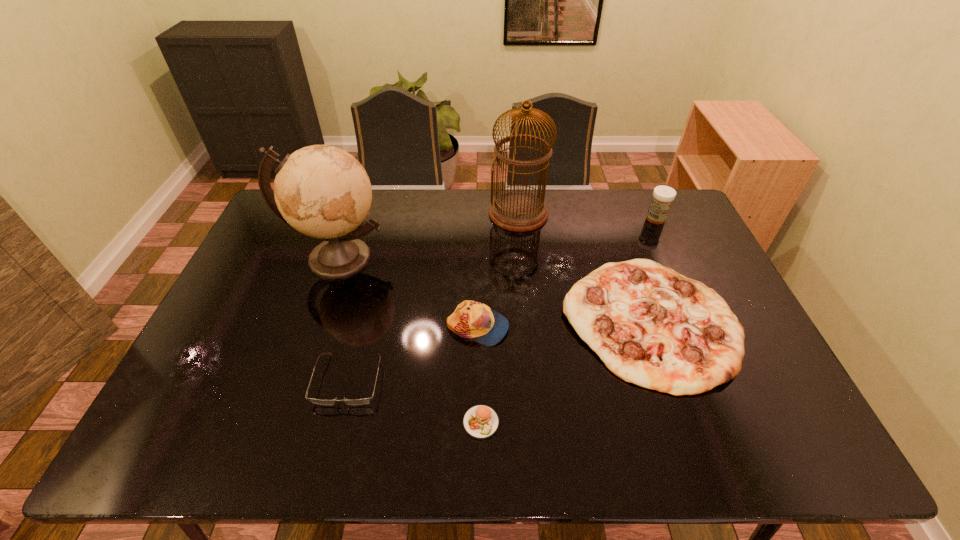
This screenshot has width=960, height=540. I want to click on vacant region located on the bill of the fourth tallest object, so click(645, 327).

Where is `vacant space located 0.060m on the front of the fifth tallest object`? The image size is (960, 540). vacant space located 0.060m on the front of the fifth tallest object is located at coordinates (684, 420).

You are a GUI agent. You are given a task and a screenshot of the screen. Output one action in this format:
    pyautogui.click(x=<x>, y=<y>)
    Task: Click on the vacant position located 0.060m on the right of the shortest object
    The height and width of the screenshot is (540, 960).
    Given the screenshot: What is the action you would take?
    pyautogui.click(x=525, y=422)

Identify the location of birdcage situated at the far edge. (519, 211).

Where is `medicine that is positioned at the far edge`? Image resolution: width=960 pixels, height=540 pixels. medicine that is positioned at the far edge is located at coordinates point(663,196).

Where is `object that is at the near edge`? The width and height of the screenshot is (960, 540). object that is at the near edge is located at coordinates (481, 422).

Locate an element on the screen. Image resolution: width=960 pixels, height=540 pixels. object positioned at the left edge is located at coordinates (321, 191).

I want to click on medicine located at the right edge, so click(x=663, y=196).

At what (x,y) coordinates should I click in order to perform the action: click on pizza present at the right edge. Please return your answer as a coordinate pair (x, y). The height and width of the screenshot is (540, 960). Looking at the image, I should click on click(651, 326).

The width and height of the screenshot is (960, 540). I want to click on object situated at the far right corner, so click(663, 196).